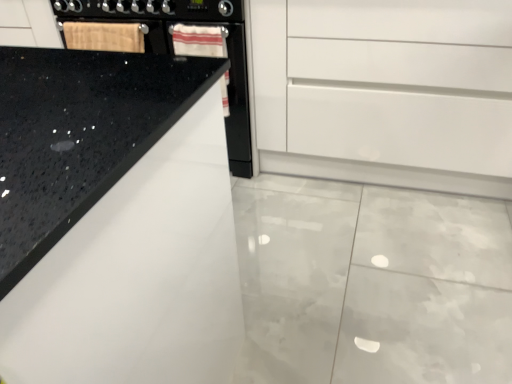
Question: Can you confirm if black granite countertop at upper left is smaller than white glossy cabinet at center?

Choices:
 (A) no
 (B) yes

Answer: (A)

Question: Can you confirm if black granite countertop at upper left is thinner than white glossy cabinet at center?

Choices:
 (A) no
 (B) yes

Answer: (A)

Question: Does black granite countertop at upper left appear on the left side of white glossy cabinet at center?

Choices:
 (A) no
 (B) yes

Answer: (B)

Question: Is black granite countertop at upper left turned away from white glossy cabinet at center?

Choices:
 (A) no
 (B) yes

Answer: (B)

Question: Considering the relative sizes of black granite countertop at upper left and white glossy cabinet at center in the image provided, is black granite countertop at upper left shorter than white glossy cabinet at center?

Choices:
 (A) yes
 (B) no

Answer: (B)

Question: From a real-world perspective, is black granite countertop at upper left beneath white glossy cabinet at center?

Choices:
 (A) no
 (B) yes

Answer: (A)

Question: Is wooden cutting board at upper left at the left side of white glossy cabinet at center?

Choices:
 (A) no
 (B) yes

Answer: (B)

Question: Is wooden cutting board at upper left surrounding white glossy cabinet at center?

Choices:
 (A) yes
 (B) no

Answer: (B)

Question: Considering the relative sizes of wooden cutting board at upper left and white glossy cabinet at center in the image provided, is wooden cutting board at upper left wider than white glossy cabinet at center?

Choices:
 (A) no
 (B) yes

Answer: (A)

Question: Can you see wooden cutting board at upper left touching white glossy cabinet at center?

Choices:
 (A) no
 (B) yes

Answer: (A)

Question: Would you say wooden cutting board at upper left is outside white glossy cabinet at center?

Choices:
 (A) no
 (B) yes

Answer: (B)

Question: Is wooden cutting board at upper left positioned in front of white glossy cabinet at center?

Choices:
 (A) no
 (B) yes

Answer: (A)

Question: Can you confirm if black granite countertop at upper left is shorter than wooden cutting board at upper left?

Choices:
 (A) yes
 (B) no

Answer: (B)